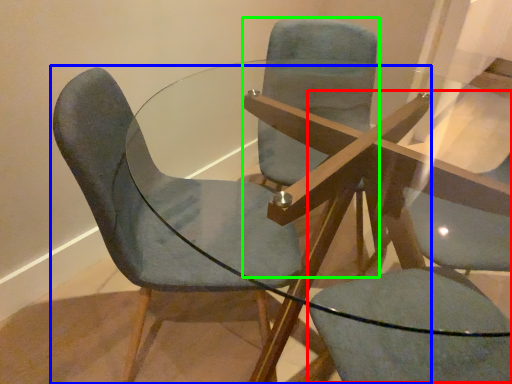
Question: Considering the real-world distances, which object is closest to swivel chair (highlighted by a red box)? chair (highlighted by a blue box) or chair (highlighted by a green box).

Choices:
 (A) chair
 (B) chair

Answer: (A)